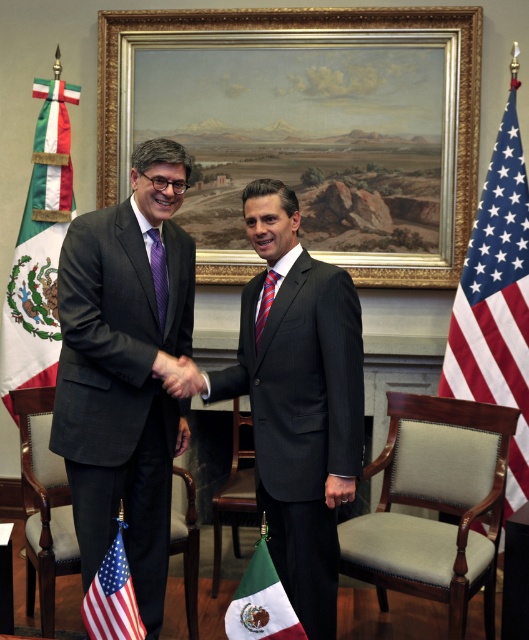
Question: Does smooth skin handshake at center come in front of striped silk tie at center?

Choices:
 (A) yes
 (B) no

Answer: (A)

Question: Can you confirm if red-white-blue fabric flag at right is positioned above purple striped tie at center?

Choices:
 (A) no
 (B) yes

Answer: (A)

Question: Which object is the farthest from the american flag at lower left?

Choices:
 (A) striped silk tie at center
 (B) red-white-blue fabric flag at right
 (C) white fabric flag at left
 (D) matte black suit at center

Answer: (C)

Question: Which point appears closest to the camera in this image?

Choices:
 (A) (115, 627)
 (B) (165, 298)

Answer: (A)

Question: Estimate the real-world distances between objects in this image. Which object is closer to the matte black suit at center?

Choices:
 (A) striped silk tie at center
 (B) white fabric flag at left

Answer: (A)

Question: Is american flag at lower left positioned at the back of smooth skin handshake at center?

Choices:
 (A) yes
 (B) no

Answer: (B)